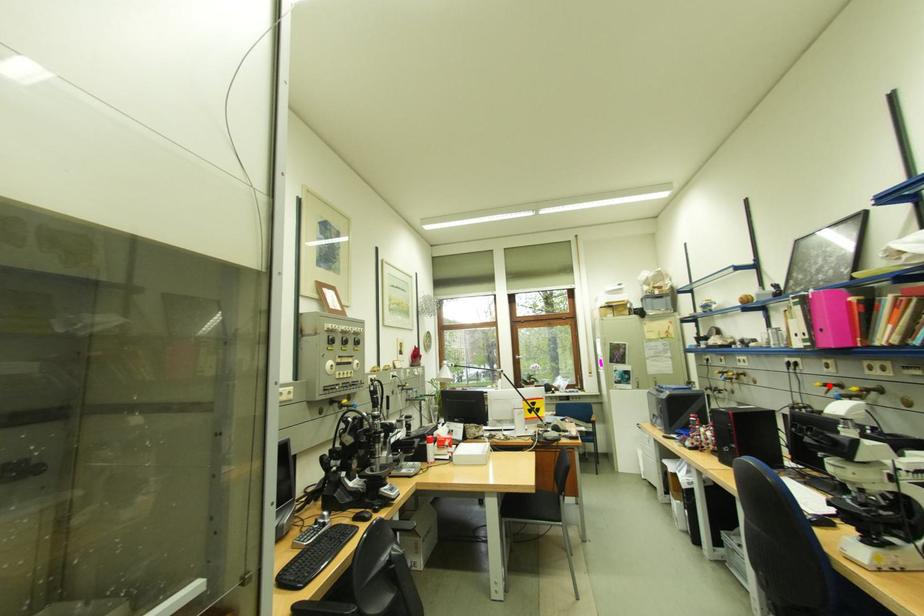
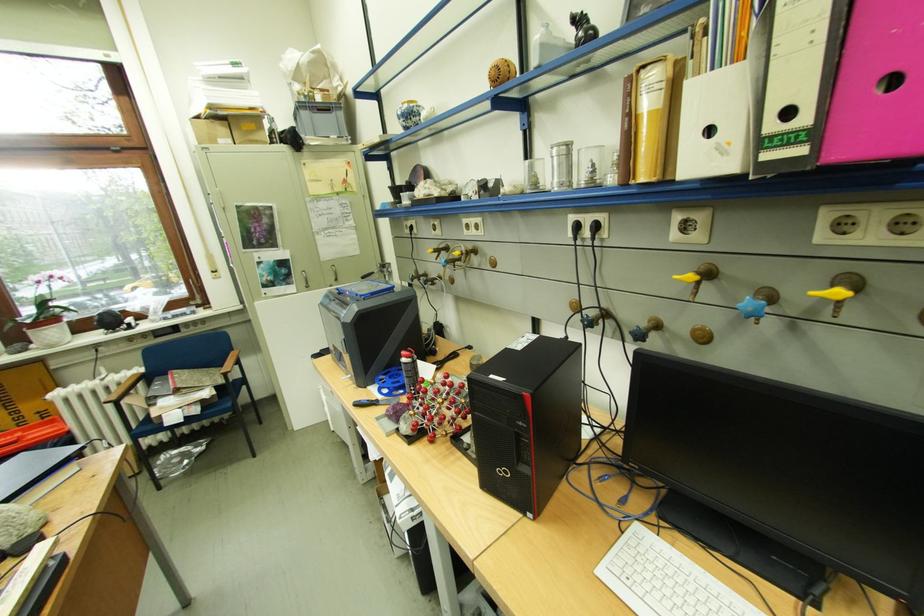
Where in the second image is the point corresponding to the highlighted location from the first image?

(700, 277)